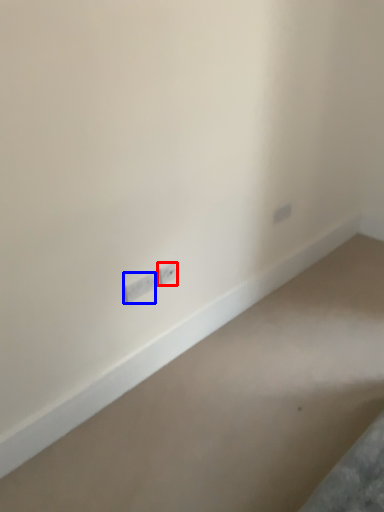
Question: Which object is closer to the camera taking this photo, power plugs and sockets (highlighted by a red box) or power plugs and sockets (highlighted by a blue box)?

Choices:
 (A) power plugs and sockets
 (B) power plugs and sockets

Answer: (B)